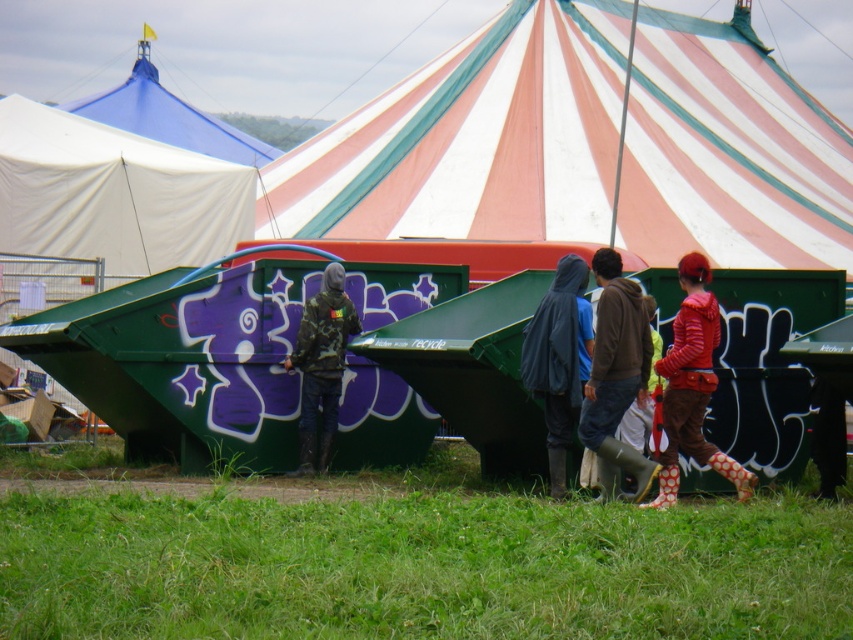
You are a photographer standing at the position of the dark blue hooded jacket at center. You want to take a photo of the striped canvas tent at center from a distance of at least 40 meters. Is your current position sufficient?

The distance between the striped canvas tent at center and the dark blue hooded jacket at center is 41.87 meters, so yes, your current position is sufficient as it exceeds the required 40 meters distance.

Where is the brown leather jacket at center located in the image?

The brown leather jacket at center is located at point 0.592 on the x axis and 0.723 on the y axis.